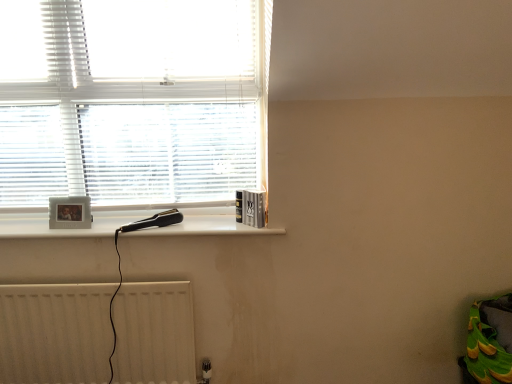
Question: Are white textured radiator at lower left and white textured blinds at upper left far apart?

Choices:
 (A) no
 (B) yes

Answer: (A)

Question: Is white textured radiator at lower left surrounding white textured blinds at upper left?

Choices:
 (A) yes
 (B) no

Answer: (B)

Question: From a real-world perspective, is white textured radiator at lower left positioned under white textured blinds at upper left based on gravity?

Choices:
 (A) yes
 (B) no

Answer: (A)

Question: Is white textured radiator at lower left looking in the opposite direction of white textured blinds at upper left?

Choices:
 (A) no
 (B) yes

Answer: (A)

Question: Does white textured radiator at lower left come in front of white textured blinds at upper left?

Choices:
 (A) yes
 (B) no

Answer: (B)

Question: Can you confirm if white textured radiator at lower left is wider than white textured blinds at upper left?

Choices:
 (A) no
 (B) yes

Answer: (A)

Question: Is white textured blinds at upper left not inside white textured radiator at lower left?

Choices:
 (A) yes
 (B) no

Answer: (A)

Question: Is white textured blinds at upper left far from white textured radiator at lower left?

Choices:
 (A) no
 (B) yes

Answer: (A)

Question: From a real-world perspective, is white textured blinds at upper left under white textured radiator at lower left?

Choices:
 (A) no
 (B) yes

Answer: (A)

Question: Considering the relative positions of white textured blinds at upper left and white textured radiator at lower left in the image provided, is white textured blinds at upper left in front of white textured radiator at lower left?

Choices:
 (A) yes
 (B) no

Answer: (A)

Question: Does white textured blinds at upper left contain white textured radiator at lower left?

Choices:
 (A) no
 (B) yes

Answer: (A)

Question: Considering the relative sizes of white textured blinds at upper left and white textured radiator at lower left in the image provided, is white textured blinds at upper left thinner than white textured radiator at lower left?

Choices:
 (A) no
 (B) yes

Answer: (A)

Question: Would you say white textured blinds at upper left contains white plastic hairdryer at upper left?

Choices:
 (A) yes
 (B) no

Answer: (B)